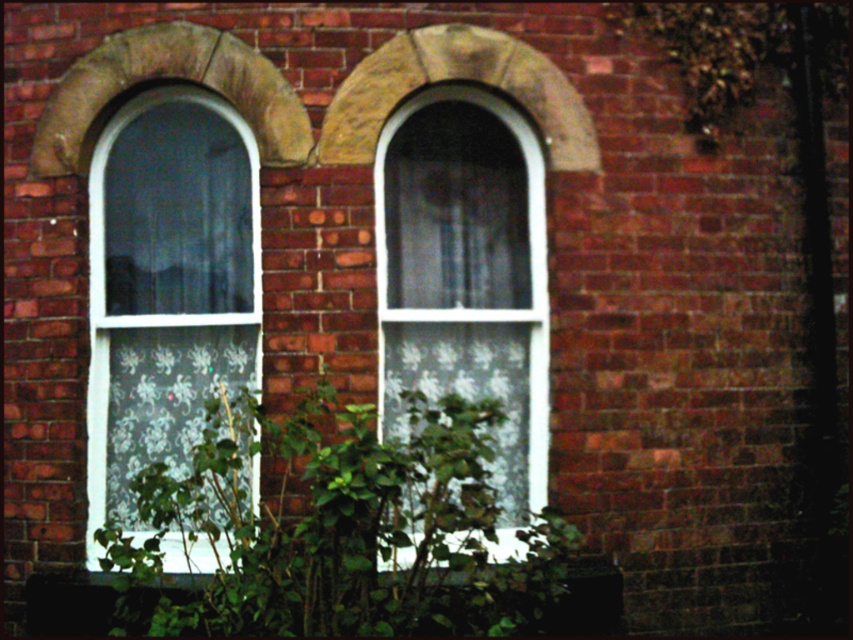
Question: Which of the following is the closest to the observer?

Choices:
 (A) (132, 259)
 (B) (39, 618)

Answer: (B)

Question: Does green leafy plant at center appear on the right side of green leafy plant at lower center?

Choices:
 (A) yes
 (B) no

Answer: (A)

Question: Which object is positioned closest to the white textured glass window at left?

Choices:
 (A) white textured glass at center
 (B) green leafy plant at lower center
 (C) green leafy plant at center

Answer: (A)

Question: Is white textured glass window at left smaller than green leafy plant at lower center?

Choices:
 (A) no
 (B) yes

Answer: (A)

Question: Considering the real-world distances, which object is closest to the green leafy plant at lower center?

Choices:
 (A) white textured glass window at left
 (B) green leafy plant at center
 (C) white textured glass at center

Answer: (B)

Question: Is green leafy plant at center bigger than green leafy plant at lower center?

Choices:
 (A) yes
 (B) no

Answer: (A)